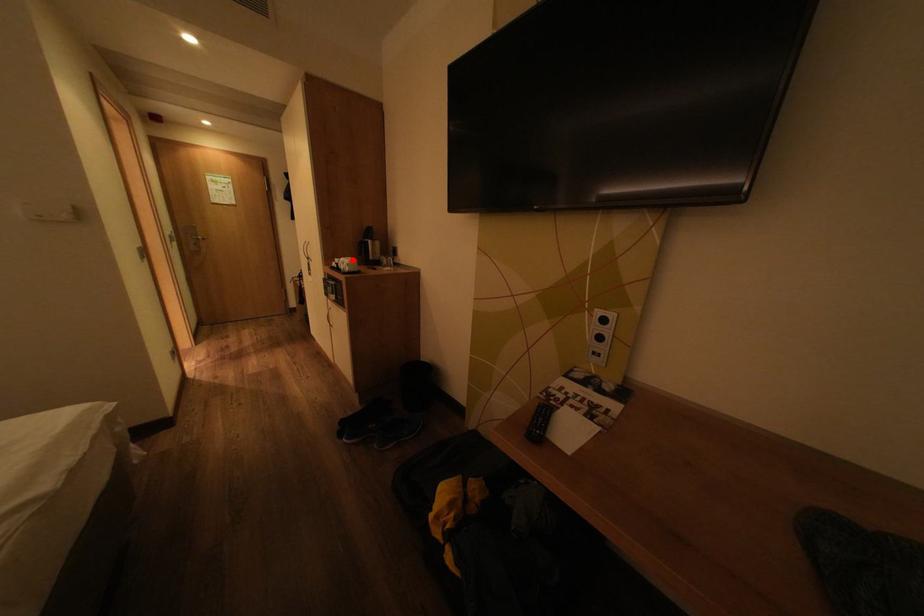
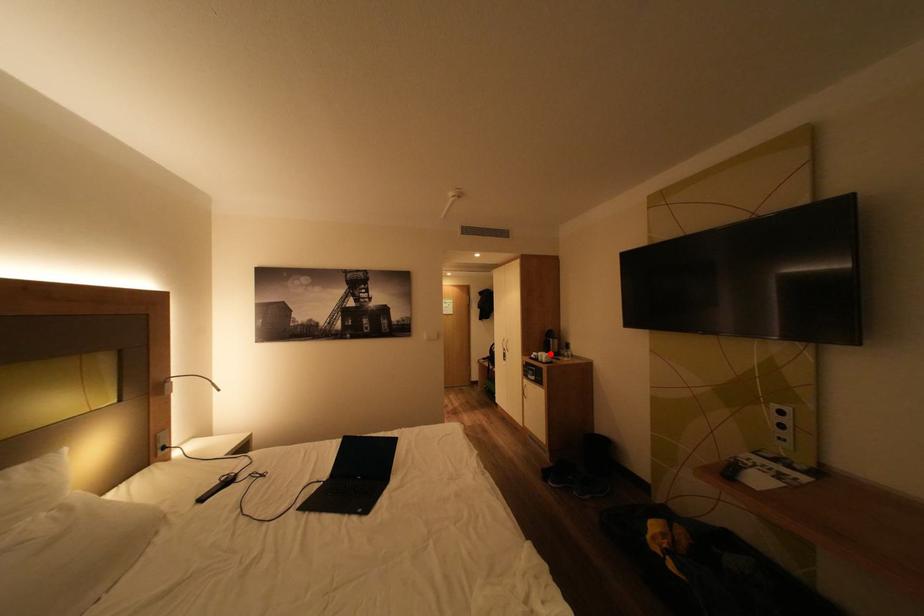
I am providing you with two images of the same scene from different viewpoints. A red point is marked on the first image and another point is marked on the second image. Do the highlighted points in image1 and image2 indicate the same real-world spot?

Yes